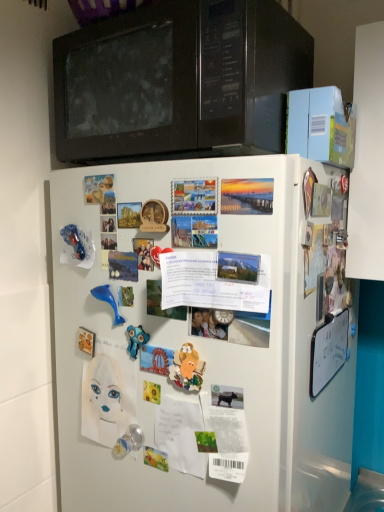
Question: Is matte paper poster at upper left, acting as the second poster starting from the right, taller or shorter than white paper at center, which appears as the second poster when viewed from the top?

Choices:
 (A) tall
 (B) short

Answer: (B)

Question: Looking at the image, does matte paper poster at upper left, positioned as the 2th poster in front-to-back order, seem bigger or smaller compared to white paper at center, positioned as the 1th poster in right-to-left order?

Choices:
 (A) big
 (B) small

Answer: (B)

Question: Considering the real-world distances, which object is farthest from the blue rubber toy at center, which appears as the 3th toy when ordered from the bottom?

Choices:
 (A) matte paper poster at upper left, which ranks as the first poster in left-to-right order
 (B) transparent plastic toy at lower center, which is counted as the 4th toy, starting from the top
 (C) white matte refrigerator at center
 (D) black matte microwave at upper center
 (E) white paper at center, arranged as the 2th poster when viewed from the left

Answer: (D)

Question: Considering the real-world distances, which object is farthest from the blue rubber toy at center, the second toy when ordered from right to left?

Choices:
 (A) matte plastic toy at center, the 1th toy from the right
 (B) matte paper poster at upper left, which is the 1th poster from back to front
 (C) blue rubber dolphin at center-left, placed as the 4th toy when sorted from bottom to top
 (D) white paper at center, positioned as the 1th poster in right-to-left order
 (E) white matte refrigerator at center

Answer: (B)